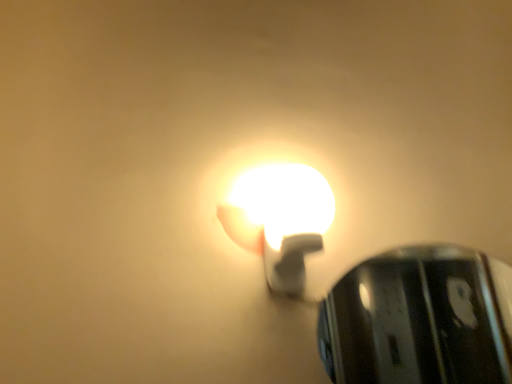
The height and width of the screenshot is (384, 512). What are the coordinates of `white glossy bulb at center, arranged as the 1th lamp when viewed from the left` in the screenshot? It's located at (280, 220).

Image resolution: width=512 pixels, height=384 pixels. What do you see at coordinates (280, 220) in the screenshot?
I see `white glossy bulb at center, which is counted as the 2th lamp, starting from the right` at bounding box center [280, 220].

How much space does white glossy bulb at center, arranged as the 1th lamp when viewed from the left, occupy horizontally?

It is 7.55 inches.

The height and width of the screenshot is (384, 512). Describe the element at coordinates (417, 320) in the screenshot. I see `glossy metallic lamp at upper center, acting as the 1th lamp starting from the right` at that location.

How much space does glossy metallic lamp at upper center, placed as the 2th lamp when sorted from left to right, occupy vertically?

13.96 inches.

Find the location of a particular element. The width and height of the screenshot is (512, 384). glossy metallic lamp at upper center, acting as the 1th lamp starting from the right is located at coordinates (417, 320).

This screenshot has width=512, height=384. What are the coordinates of `white glossy bulb at center, which is counted as the 2th lamp, starting from the right` in the screenshot? It's located at (280, 220).

Which object is positioned more to the left, glossy metallic lamp at upper center, placed as the 2th lamp when sorted from left to right, or white glossy bulb at center, arranged as the 1th lamp when viewed from the left?

white glossy bulb at center, arranged as the 1th lamp when viewed from the left.

Considering the positions of objects glossy metallic lamp at upper center, placed as the 2th lamp when sorted from left to right, and white glossy bulb at center, arranged as the 1th lamp when viewed from the left, in the image provided, who is in front, glossy metallic lamp at upper center, placed as the 2th lamp when sorted from left to right, or white glossy bulb at center, arranged as the 1th lamp when viewed from the left,?

white glossy bulb at center, arranged as the 1th lamp when viewed from the left, is more forward.

Is point (472, 346) positioned after point (298, 189)?

Yes, point (472, 346) is farther from viewer.

From the image's perspective, is glossy metallic lamp at upper center, acting as the 1th lamp starting from the right, located beneath white glossy bulb at center, which is counted as the 2th lamp, starting from the right?

Yes.

From a real-world perspective, is glossy metallic lamp at upper center, acting as the 1th lamp starting from the right, above or below white glossy bulb at center, which is counted as the 2th lamp, starting from the right?

Clearly, from a real-world perspective, glossy metallic lamp at upper center, acting as the 1th lamp starting from the right, is below white glossy bulb at center, which is counted as the 2th lamp, starting from the right.

Is glossy metallic lamp at upper center, acting as the 1th lamp starting from the right, wider or thinner than white glossy bulb at center, which is counted as the 2th lamp, starting from the right?

In the image, glossy metallic lamp at upper center, acting as the 1th lamp starting from the right, appears to be more narrow than white glossy bulb at center, which is counted as the 2th lamp, starting from the right.

Considering the sizes of objects glossy metallic lamp at upper center, acting as the 1th lamp starting from the right, and white glossy bulb at center, arranged as the 1th lamp when viewed from the left, in the image provided, who is taller, glossy metallic lamp at upper center, acting as the 1th lamp starting from the right, or white glossy bulb at center, arranged as the 1th lamp when viewed from the left,?

Standing taller between the two is glossy metallic lamp at upper center, acting as the 1th lamp starting from the right.

Between glossy metallic lamp at upper center, placed as the 2th lamp when sorted from left to right, and white glossy bulb at center, arranged as the 1th lamp when viewed from the left, which one has smaller size?

Smaller between the two is glossy metallic lamp at upper center, placed as the 2th lamp when sorted from left to right.

Is glossy metallic lamp at upper center, acting as the 1th lamp starting from the right, surrounding white glossy bulb at center, arranged as the 1th lamp when viewed from the left?

Actually, white glossy bulb at center, arranged as the 1th lamp when viewed from the left, is outside glossy metallic lamp at upper center, acting as the 1th lamp starting from the right.

Is glossy metallic lamp at upper center, placed as the 2th lamp when sorted from left to right, positioned far away from white glossy bulb at center, arranged as the 1th lamp when viewed from the left?

Yes.

Is glossy metallic lamp at upper center, acting as the 1th lamp starting from the right, oriented towards white glossy bulb at center, which is counted as the 2th lamp, starting from the right?

No, glossy metallic lamp at upper center, acting as the 1th lamp starting from the right, is not turned towards white glossy bulb at center, which is counted as the 2th lamp, starting from the right.

How different are the orientations of glossy metallic lamp at upper center, acting as the 1th lamp starting from the right, and white glossy bulb at center, arranged as the 1th lamp when viewed from the left, in degrees?

0.591 degrees separate the facing orientations of glossy metallic lamp at upper center, acting as the 1th lamp starting from the right, and white glossy bulb at center, arranged as the 1th lamp when viewed from the left.

Locate an element on the screen. lamp lying behind the white glossy bulb at center, arranged as the 1th lamp when viewed from the left is located at coordinates (417, 320).

Which object is positioned more to the left, white glossy bulb at center, arranged as the 1th lamp when viewed from the left, or glossy metallic lamp at upper center, acting as the 1th lamp starting from the right?

white glossy bulb at center, arranged as the 1th lamp when viewed from the left, is more to the left.

Between white glossy bulb at center, which is counted as the 2th lamp, starting from the right, and glossy metallic lamp at upper center, placed as the 2th lamp when sorted from left to right, which one is positioned in front?

white glossy bulb at center, which is counted as the 2th lamp, starting from the right, is more forward.

Between point (269, 237) and point (441, 344), which one is positioned behind?

Positioned behind is point (441, 344).

From the image's perspective, who appears lower, white glossy bulb at center, arranged as the 1th lamp when viewed from the left, or glossy metallic lamp at upper center, acting as the 1th lamp starting from the right?

glossy metallic lamp at upper center, acting as the 1th lamp starting from the right, from the image's perspective.

From a real-world perspective, which object rests below the other?

glossy metallic lamp at upper center, acting as the 1th lamp starting from the right, is physically lower.

Is white glossy bulb at center, arranged as the 1th lamp when viewed from the left, thinner than glossy metallic lamp at upper center, acting as the 1th lamp starting from the right?

Incorrect, the width of white glossy bulb at center, arranged as the 1th lamp when viewed from the left, is not less than that of glossy metallic lamp at upper center, acting as the 1th lamp starting from the right.

Considering the relative sizes of white glossy bulb at center, arranged as the 1th lamp when viewed from the left, and glossy metallic lamp at upper center, acting as the 1th lamp starting from the right, in the image provided, is white glossy bulb at center, arranged as the 1th lamp when viewed from the left, taller than glossy metallic lamp at upper center, acting as the 1th lamp starting from the right,?

No, white glossy bulb at center, arranged as the 1th lamp when viewed from the left, is not taller than glossy metallic lamp at upper center, acting as the 1th lamp starting from the right.

Is white glossy bulb at center, which is counted as the 2th lamp, starting from the right, bigger than glossy metallic lamp at upper center, acting as the 1th lamp starting from the right?

Yes.

Is glossy metallic lamp at upper center, acting as the 1th lamp starting from the right, located within white glossy bulb at center, arranged as the 1th lamp when viewed from the left?

No.

Are white glossy bulb at center, arranged as the 1th lamp when viewed from the left, and glossy metallic lamp at upper center, placed as the 2th lamp when sorted from left to right, making contact?

No, white glossy bulb at center, arranged as the 1th lamp when viewed from the left, is not next to glossy metallic lamp at upper center, placed as the 2th lamp when sorted from left to right.

Is white glossy bulb at center, which is counted as the 2th lamp, starting from the right, positioned with its back to glossy metallic lamp at upper center, acting as the 1th lamp starting from the right?

That's not correct — white glossy bulb at center, which is counted as the 2th lamp, starting from the right, is not looking away from glossy metallic lamp at upper center, acting as the 1th lamp starting from the right.

How many degrees apart are the facing directions of white glossy bulb at center, which is counted as the 2th lamp, starting from the right, and glossy metallic lamp at upper center, acting as the 1th lamp starting from the right?

They differ by 0.591 degrees in their facing directions.

The height and width of the screenshot is (384, 512). In order to click on lamp on the left of glossy metallic lamp at upper center, acting as the 1th lamp starting from the right in this screenshot , I will do (x=280, y=220).

In the image, there is a white glossy bulb at center, which is counted as the 2th lamp, starting from the right. Find the location of `lamp below it (from a real-world perspective)`. lamp below it (from a real-world perspective) is located at coordinates (417, 320).

Locate an element on the screen. lamp above the glossy metallic lamp at upper center, acting as the 1th lamp starting from the right (from a real-world perspective) is located at coordinates (280, 220).